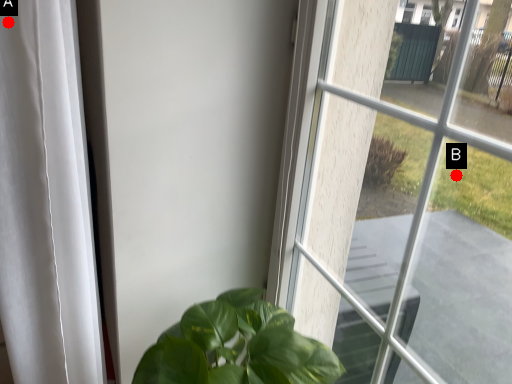
Question: Two points are circled on the image, labeled by A and B beside each circle. Which of the following is the closest to the observer?

Choices:
 (A) A is closer
 (B) B is closer

Answer: (A)